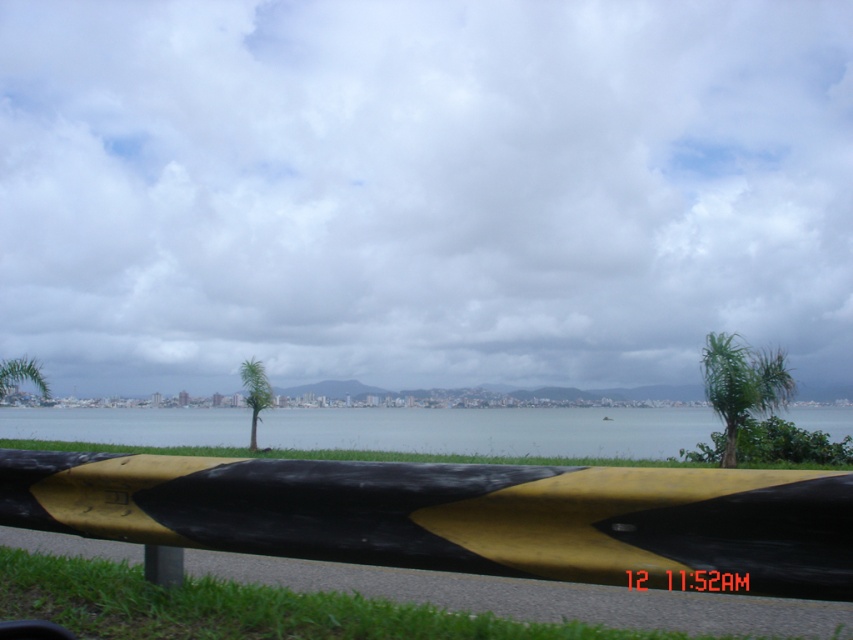
Question: Is yellow matte barrier at center closer to the viewer compared to yellow matte pole at lower center?

Choices:
 (A) yes
 (B) no

Answer: (A)

Question: Considering the relative positions of blue water at center and yellow matte pole at lower center in the image provided, where is blue water at center located with respect to yellow matte pole at lower center?

Choices:
 (A) below
 (B) above

Answer: (A)

Question: Among these points, which one is nearest to the camera?

Choices:
 (A) (167, 540)
 (B) (407, 436)

Answer: (A)

Question: Which object is the farthest from the yellow matte pole at lower center?

Choices:
 (A) yellow matte barrier at center
 (B) blue water at center

Answer: (B)

Question: Which point is farther to the camera?

Choices:
 (A) blue water at center
 (B) yellow matte pole at lower center
 (C) yellow matte barrier at center

Answer: (A)

Question: Can you confirm if yellow matte barrier at center is positioned below yellow matte pole at lower center?

Choices:
 (A) yes
 (B) no

Answer: (B)